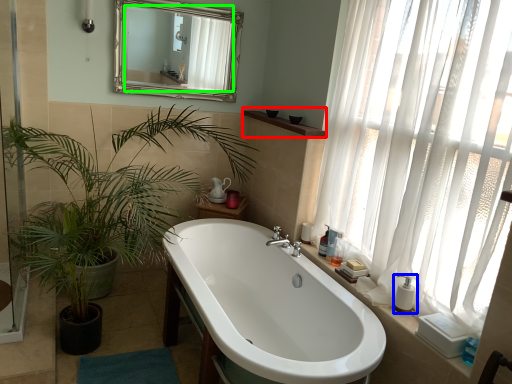
Question: Which object is the farthest from window sill (highlighted by a red box)? Choose among these: soap dispenser (highlighted by a blue box) or mirror (highlighted by a green box).

Choices:
 (A) soap dispenser
 (B) mirror

Answer: (A)